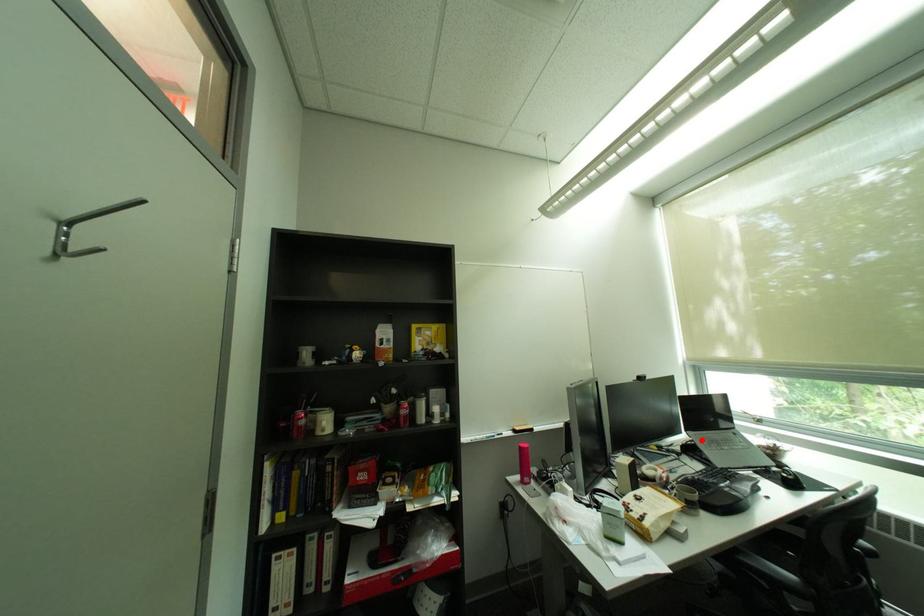
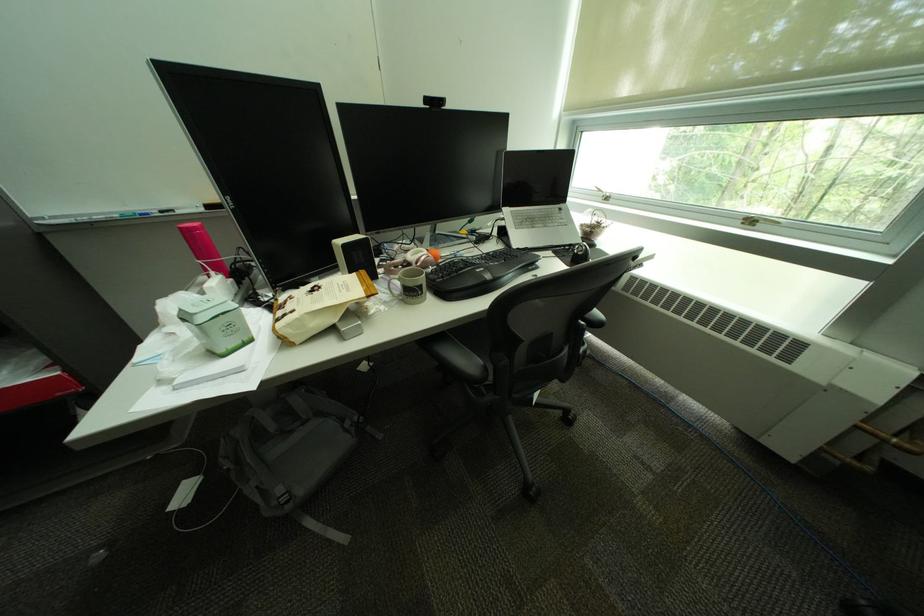
Question: I am providing you with two images of the same scene from different viewpoints. In image1, a red point is highlighted. Considering the same 3D point in image2, which of the following is correct?

Choices:
 (A) It is closer
 (B) It is farther

Answer: (A)